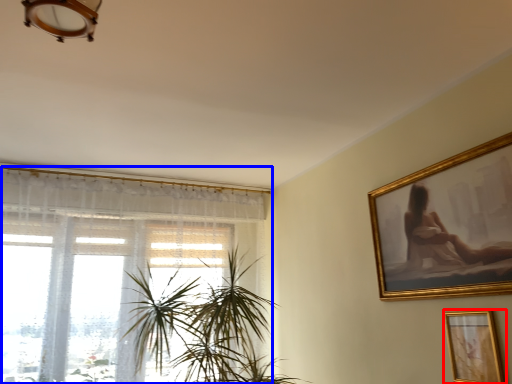
Question: Which object appears farthest to the camera in this image, picture frame (highlighted by a red box) or window (highlighted by a blue box)?

Choices:
 (A) picture frame
 (B) window

Answer: (B)